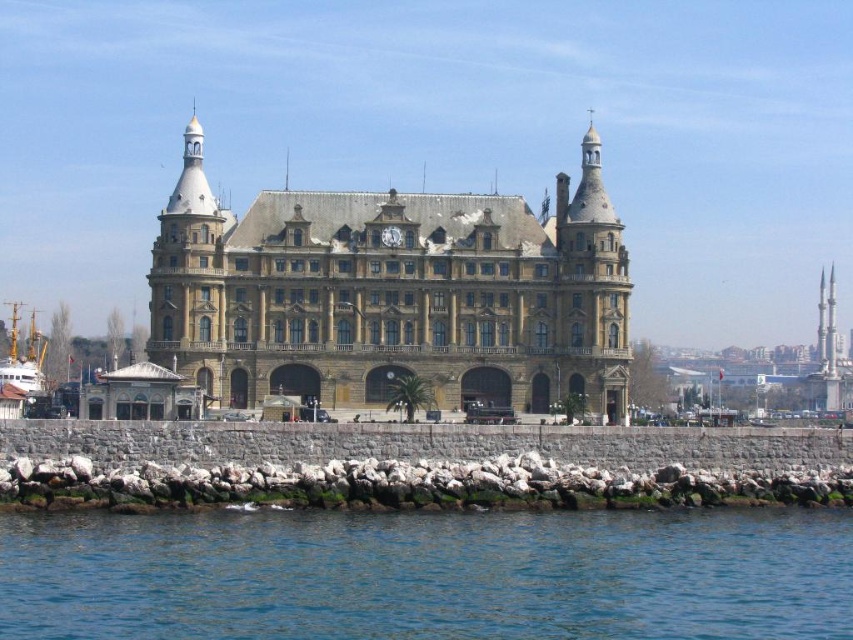
Question: Can you confirm if blue liquid water at lower center is positioned above wooden ship at lower left?

Choices:
 (A) yes
 (B) no

Answer: (B)

Question: Is the position of brown stone building at center more distant than that of wooden ship at lower left?

Choices:
 (A) yes
 (B) no

Answer: (B)

Question: Does blue liquid water at lower center have a smaller size compared to brown stone building at center?

Choices:
 (A) no
 (B) yes

Answer: (B)

Question: Which of these objects is positioned closest to the wooden ship at lower left?

Choices:
 (A) brown stone building at center
 (B) blue liquid water at lower center

Answer: (A)

Question: Which object is farther from the camera taking this photo?

Choices:
 (A) brown stone building at center
 (B) blue liquid water at lower center
 (C) wooden ship at lower left

Answer: (C)

Question: Which point is farther from the camera taking this photo?

Choices:
 (A) (482, 561)
 (B) (265, 246)
 (C) (15, 416)

Answer: (B)